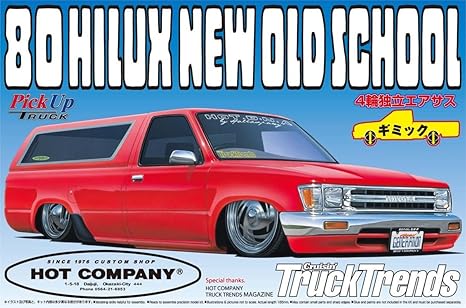
You are a GUI agent. You are given a task and a screenshot of the screen. Output one action in this format:
    pyautogui.click(x=<x>, y=<y>)
    Task: Click on the handle
    Image resolution: width=466 pixels, height=308 pixels.
    Given the screenshot: What is the action you would take?
    pyautogui.click(x=139, y=176)